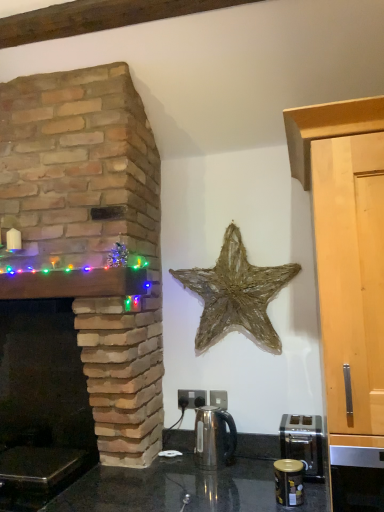
What are the coordinates of `vacant space in woven straw star at center (from a real-world perspective)` in the screenshot? It's located at click(x=246, y=459).